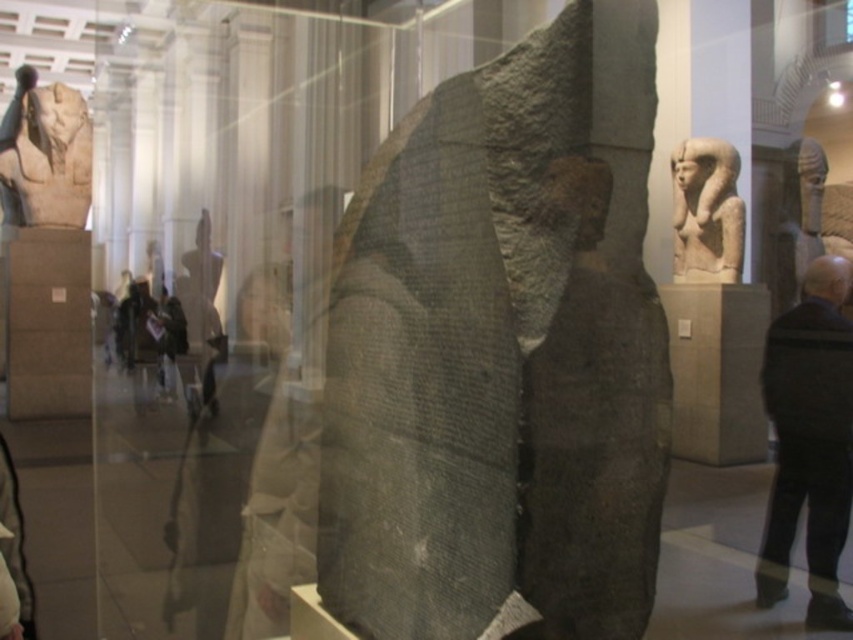
You are a visitor at the museum and want to take a photo of the gray stone stele at center without any obstructions. The black wool coat at right is hanging nearby. Considering their sizes, which object takes up more space horizontally in the image?

The gray stone stele at center takes up more space horizontally in the image because its width is larger than that of the black wool coat at right.

You are a tour guide leading a group through the museum. You want to ensure that all visitors can clearly see the gray stone stele at center from their current position. Considering the distance between the visitors and the stele, what is the minimum height of the display case that would allow the visitors to see the top of the stele without obstruction?

The gray stone stele at center is 1.36 meters from the camera. To ensure visitors can see the top of the stele without obstruction, the display case must be at least 1.36 meters tall, matching the distance from the visitors to the stele.

You are standing in the museum and want to touch the point at coordinates (498, 230). The museum has a rule that visitors must stay at least 1.5 meters away from all artifacts. Can you safely touch this point without breaking the rule?

The point at coordinates (498, 230) is 1.45 meters away from you, which is less than the required 1.5 meters. Therefore, touching it would violate the museum rule.